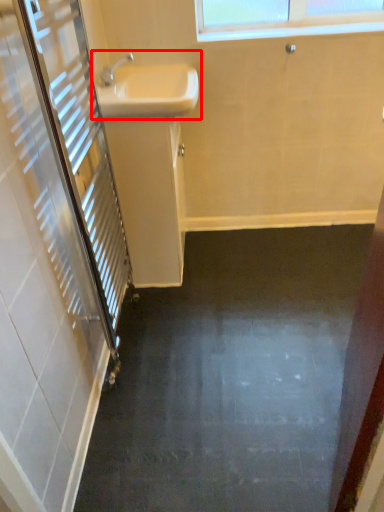
Question: Considering the relative positions of sink (annotated by the red box) and sink in the image provided, where is sink (annotated by the red box) located with respect to the staircase?

Choices:
 (A) left
 (B) right

Answer: (B)